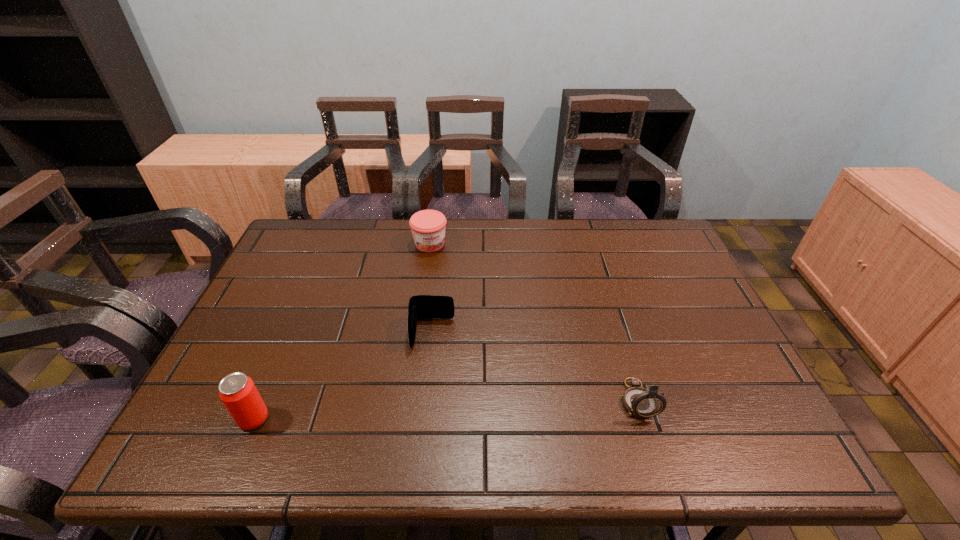
Where is `vacant space located 0.140m on the outer surface of the second farthest object`? vacant space located 0.140m on the outer surface of the second farthest object is located at coordinates tap(427, 400).

What are the coordinates of `object present at the far edge` in the screenshot? It's located at (428, 227).

Locate an element on the screen. beer can that is at the near edge is located at coordinates (237, 391).

The width and height of the screenshot is (960, 540). In order to click on compass that is positioned at the near edge in this screenshot , I will do coord(642,403).

Where is `object positioned at the left edge`? The width and height of the screenshot is (960, 540). object positioned at the left edge is located at coordinates (237, 391).

At what (x,y) coordinates should I click in order to perform the action: click on object at the near left corner. Please return your answer as a coordinate pair (x, y). This screenshot has width=960, height=540. Looking at the image, I should click on (237, 391).

The width and height of the screenshot is (960, 540). Identify the location of vacant space at the far edge. (620, 242).

Where is `vacant space at the near edge of the desktop`? This screenshot has height=540, width=960. vacant space at the near edge of the desktop is located at coordinates (378, 395).

In the image, there is a desktop. Where is `vacant space at the left edge`? vacant space at the left edge is located at coordinates (256, 330).

This screenshot has width=960, height=540. In order to click on free space at the right edge of the desktop in this screenshot , I will do pyautogui.click(x=685, y=262).